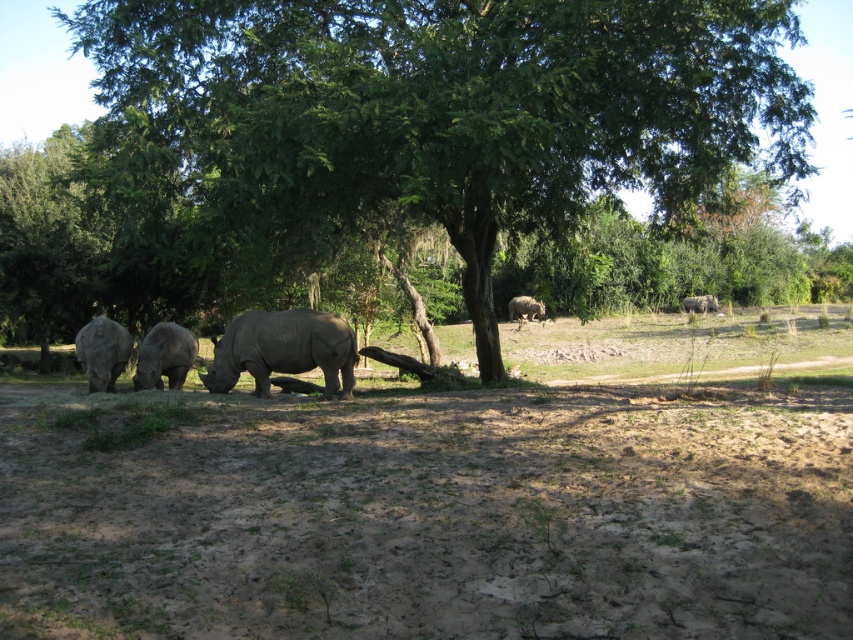
You are a photographer trying to capture a wide shot of the matte gray rhinoceros at left and the brown sandy dirt at lower center. Based on the scene, which object occupies more horizontal space in the image?

The brown sandy dirt at lower center occupies more horizontal space because its width surpasses that of the matte gray rhinoceros at left.

Consider the image. You are a photographer trying to capture a clear shot of the matte gray rhinoceros at center. Since the brown sandy dirt at lower center is in the foreground, will it block your view of the rhinoceros?

The brown sandy dirt at lower center has a lesser height compared to matte gray rhinoceros at center, so it will not block your view of the matte gray rhinoceros at center.

You are standing at the point marked as point (102,352) in the image. Looking around, you see a matte gray rhinoceros at left. Which direction should you move to get closer to the matte gray rhinoceros at left?

Since the matte gray rhinoceros at left is located to your left side at point (102,352), you should move to your left to get closer to it.